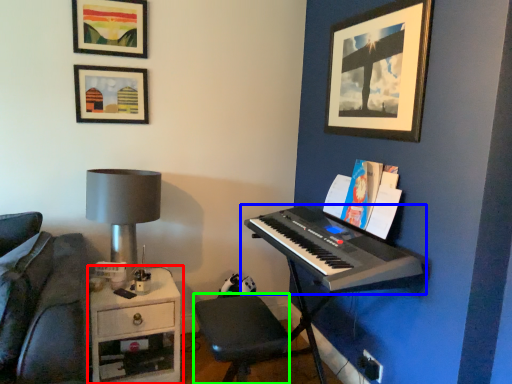
Question: Based on their relative distances, which object is farther from table (highlighted by a red box)? Choose from musical keyboard (highlighted by a blue box) and step stool (highlighted by a green box).

Choices:
 (A) musical keyboard
 (B) step stool

Answer: (A)